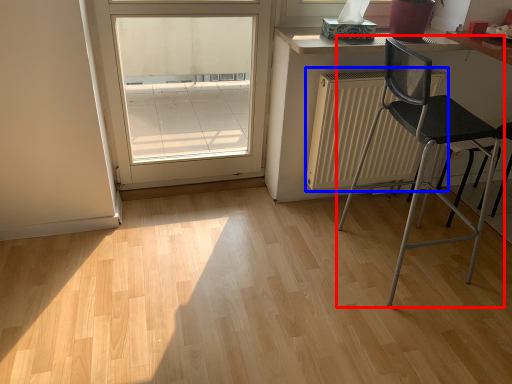
Question: Which object appears farthest to the camera in this image, chair (highlighted by a red box) or radiator (highlighted by a blue box)?

Choices:
 (A) chair
 (B) radiator

Answer: (B)